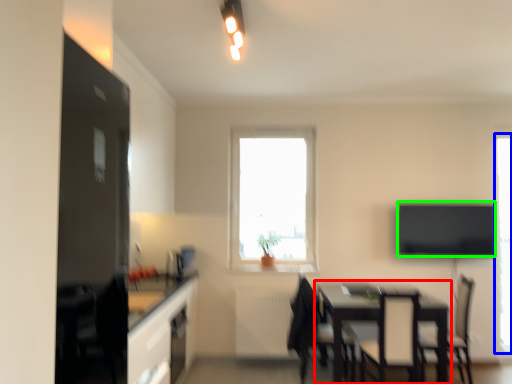
Question: Based on their relative distances, which object is farther from table (highlighted by a red box)? Choose from window (highlighted by a blue box) and window screen (highlighted by a green box).

Choices:
 (A) window
 (B) window screen

Answer: (A)